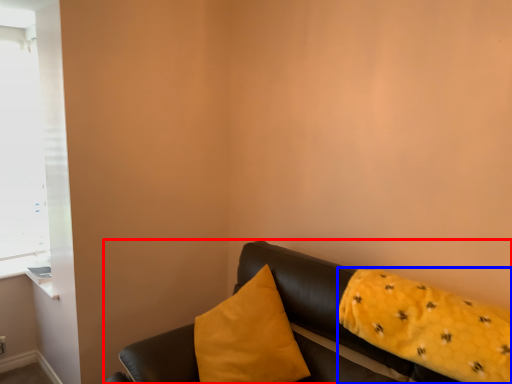
Question: Which point is further to the camera, studio couch (highlighted by a red box) or pillow (highlighted by a blue box)?

Choices:
 (A) studio couch
 (B) pillow

Answer: (B)